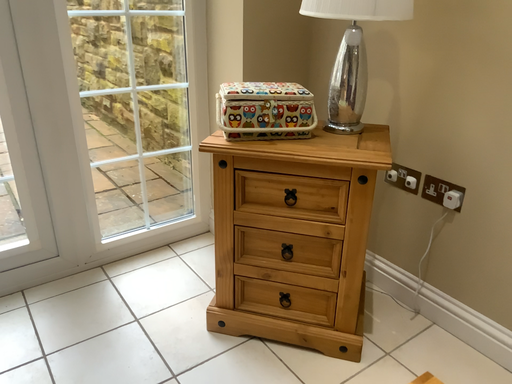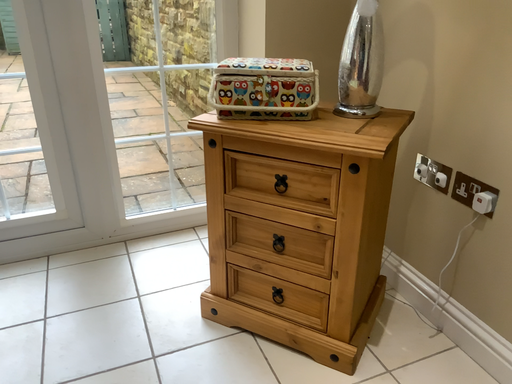
Question: How did the camera likely rotate when shooting the video?

Choices:
 (A) rotated left
 (B) rotated right

Answer: (A)